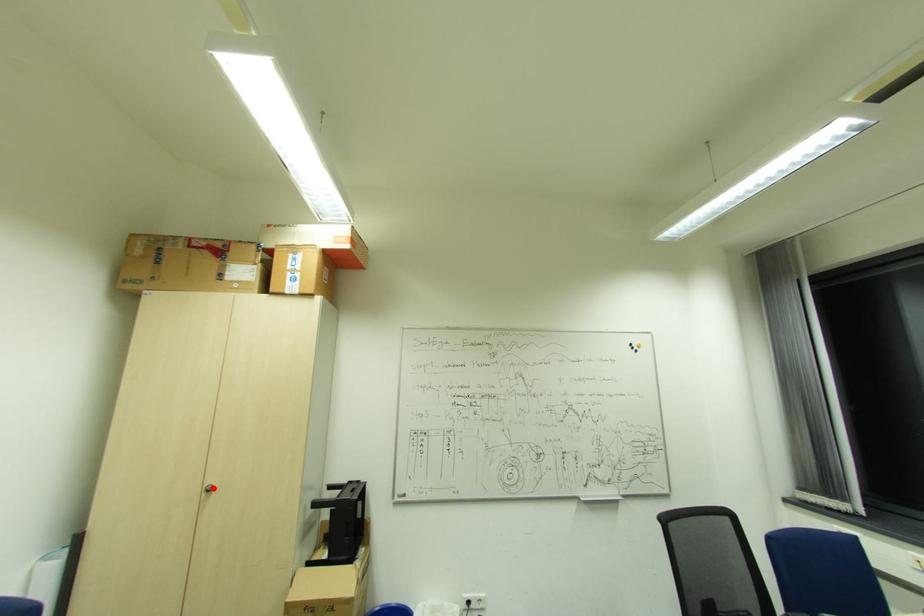
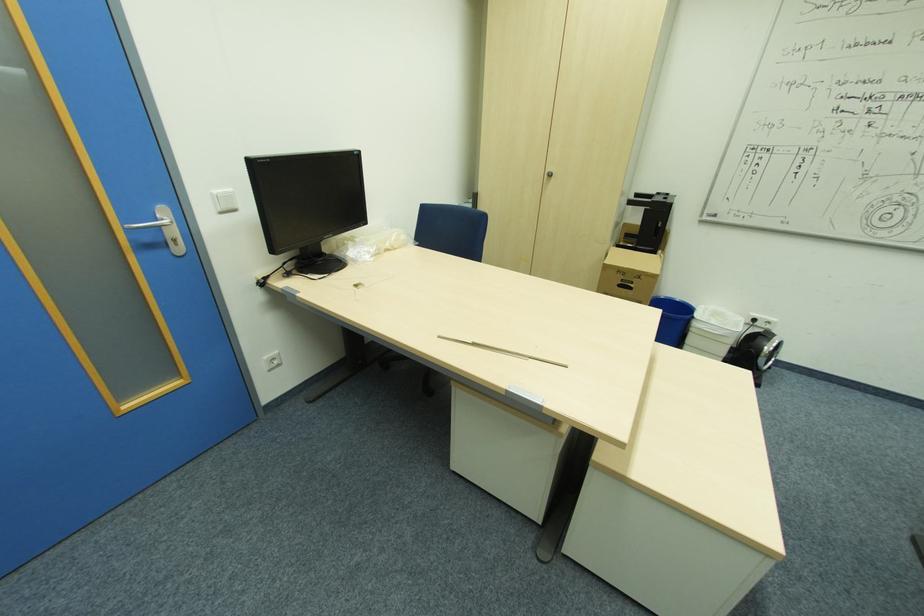
In the second image, find the point that corresponds to the highlighted location in the first image.

(553, 175)